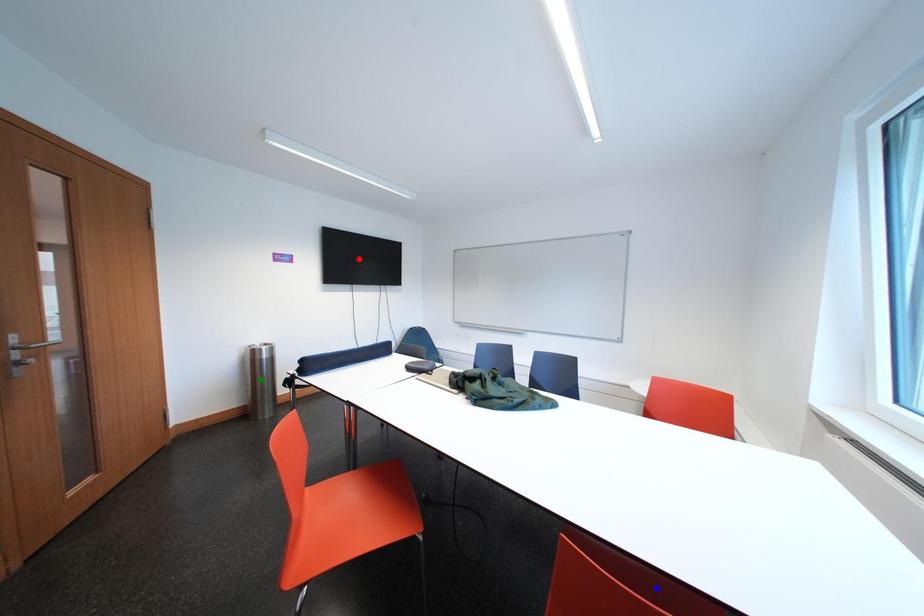
Order these from nearest to farthest:
green point, blue point, red point

blue point, green point, red point